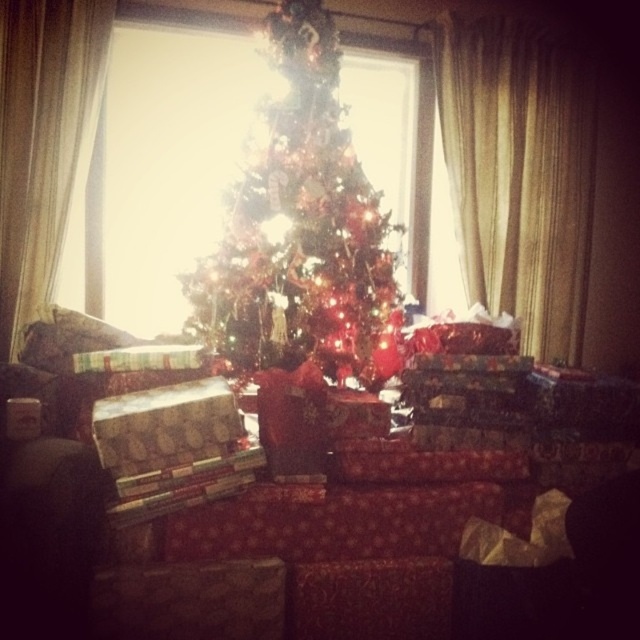
You are standing in front of the Christmas tree and want to open the gold textured curtain at right to let more light in. Based on the coordinates provided, where exactly is the gold textured curtain located relative to the Christmas tree?

The gold textured curtain at right is located at coordinates point (x=518, y=173) relative to the Christmas tree.

You are planning to take a photograph of the iridescent glass christmas tree at center and the white sheer curtain at left. Since you want both to be clearly visible in the photo, which object should you focus on first to ensure proper focus? Please explain your reasoning based on their sizes and positions.

The iridescent glass christmas tree at center is larger in size than the white sheer curtain at left. Therefore, you should focus on the iridescent glass christmas tree at center first because its larger size means it will occupy more of the frame, making its sharpness critical for the overall composition.

You are a guest standing in the living room and want to admire the iridescent glass christmas tree at center and the white sheer curtain at left. Which object is closer to the large window?

The white sheer curtain at left is closer to the large window because the iridescent glass christmas tree at center is positioned on the right side of it, meaning the curtain is between the tree and the window.